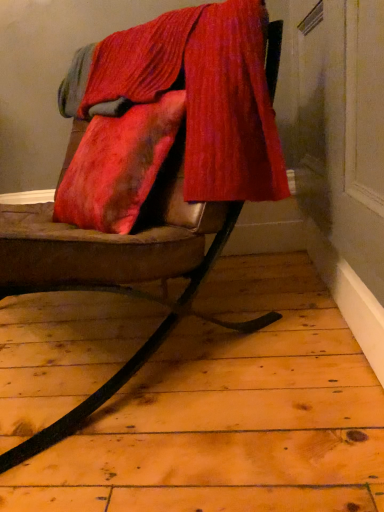
This screenshot has width=384, height=512. Find the location of `leather cushion at center`. leather cushion at center is located at coordinates (117, 272).

The image size is (384, 512). Describe the element at coordinates (117, 272) in the screenshot. I see `leather cushion at center` at that location.

Where is `velvetvelvetvelvet at upper center`? velvetvelvetvelvet at upper center is located at coordinates (195, 93).

Image resolution: width=384 pixels, height=512 pixels. What do you see at coordinates (195, 93) in the screenshot?
I see `velvetvelvetvelvet at upper center` at bounding box center [195, 93].

Locate an element on the screen. This screenshot has width=384, height=512. leather cushion at center is located at coordinates (117, 272).

Looking at this image, is velvetvelvetvelvet at upper center at the left side of leather cushion at center?

No.

Is velvetvelvetvelvet at upper center positioned behind leather cushion at center?

That is True.

Which point is more forward, (76,57) or (198,316)?

Point (198,316)

From the image's perspective, is velvetvelvetvelvet at upper center over leather cushion at center?

Yes, from the image's perspective, velvetvelvetvelvet at upper center is on top of leather cushion at center.

From a real-world perspective, is velvetvelvetvelvet at upper center beneath leather cushion at center?

Incorrect, from a real-world perspective, velvetvelvetvelvet at upper center is higher than leather cushion at center.

Between velvetvelvetvelvet at upper center and leather cushion at center, which one has smaller width?

velvetvelvetvelvet at upper center is thinner.

Considering the relative sizes of velvetvelvetvelvet at upper center and leather cushion at center in the image provided, is velvetvelvetvelvet at upper center shorter than leather cushion at center?

Yes, velvetvelvetvelvet at upper center is shorter than leather cushion at center.

In terms of size, does velvetvelvetvelvet at upper center appear bigger or smaller than leather cushion at center?

In the image, velvetvelvetvelvet at upper center appears to be smaller than leather cushion at center.

Do you think velvetvelvetvelvet at upper center is within leather cushion at center, or outside of it?

The correct answer is: inside.

Looking at this image, would you say velvetvelvetvelvet at upper center is a long distance from leather cushion at center?

No, velvetvelvetvelvet at upper center is not far from leather cushion at center.

From the picture: Is velvetvelvetvelvet at upper center looking in the opposite direction of leather cushion at center?

Yes, velvetvelvetvelvet at upper center's orientation is away from leather cushion at center.

How many degrees apart are the facing directions of velvetvelvetvelvet at upper center and leather cushion at center?

0.00163 degrees separate the facing orientations of velvetvelvetvelvet at upper center and leather cushion at center.

Measure the distance from velvetvelvetvelvet at upper center to leather cushion at center.

The distance of velvetvelvetvelvet at upper center from leather cushion at center is 9.21 inches.

Locate an element on the screen. velvet that is on the right side of leather cushion at center is located at coordinates (195, 93).

Between leather cushion at center and velvetvelvetvelvet at upper center, which one appears on the right side from the viewer's perspective?

velvetvelvetvelvet at upper center is more to the right.

Is leather cushion at center positioned behind velvetvelvetvelvet at upper center?

No.

Considering the positions of point (99, 404) and point (225, 99), is point (99, 404) closer or farther from the camera than point (225, 99)?

Point (99, 404) appears to be closer to the viewer than point (225, 99).

From the image's perspective, is leather cushion at center positioned above or below velvetvelvetvelvet at upper center?

leather cushion at center is below velvetvelvetvelvet at upper center.

From a real-world perspective, which is physically above, leather cushion at center or velvetvelvetvelvet at upper center?

velvetvelvetvelvet at upper center, from a real-world perspective.

Is leather cushion at center wider than velvetvelvetvelvet at upper center?

Yes.

Who is taller, leather cushion at center or velvetvelvetvelvet at upper center?

With more height is leather cushion at center.

Is leather cushion at center bigger or smaller than velvetvelvetvelvet at upper center?

Clearly, leather cushion at center is larger in size than velvetvelvetvelvet at upper center.

Based on the photo, is velvetvelvetvelvet at upper center inside leather cushion at center?

Yes, velvetvelvetvelvet at upper center is a part of leather cushion at center.

Based on the photo, are leather cushion at center and velvetvelvetvelvet at upper center far apart?

They are positioned close to each other.

Could you tell me if leather cushion at center is turned towards velvetvelvetvelvet at upper center?

No, leather cushion at center is not facing towards velvetvelvetvelvet at upper center.

How different are the orientations of leather cushion at center and velvetvelvetvelvet at upper center in degrees?

0.00163 degrees.

Identify the location of velvet that appears above the leather cushion at center (from a real-world perspective). (195, 93).

Where is `velvet located above the leather cushion at center (from a real-world perspective)`? This screenshot has width=384, height=512. velvet located above the leather cushion at center (from a real-world perspective) is located at coordinates (195, 93).

At what (x,y) coordinates should I click in order to perform the action: click on velvet located on the right of leather cushion at center. Please return your answer as a coordinate pair (x, y). Looking at the image, I should click on (195, 93).